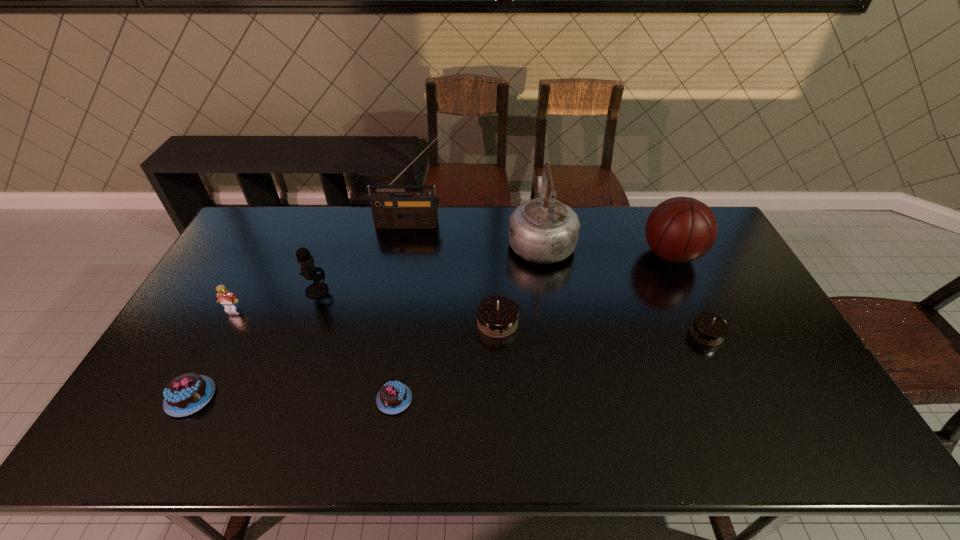
Where is `radio receiver`? radio receiver is located at coordinates (417, 209).

Image resolution: width=960 pixels, height=540 pixels. Identify the location of kettle. (545, 231).

I want to click on the seventh shortest object, so click(681, 229).

Identify the location of basketball. This screenshot has height=540, width=960. (681, 229).

Find the location of a particular element. This screenshot has width=960, height=540. microphone is located at coordinates (318, 289).

This screenshot has width=960, height=540. I want to click on black microphone, so click(x=318, y=289).

The image size is (960, 540). I want to click on Lego, so click(x=228, y=300).

Locate an element on the screen. the second chocolate cake from right to left is located at coordinates (497, 315).

The height and width of the screenshot is (540, 960). I want to click on the bigger chocolate chocolate cake, so click(497, 315).

Where is `the rightmost chocolate cake`? the rightmost chocolate cake is located at coordinates (709, 329).